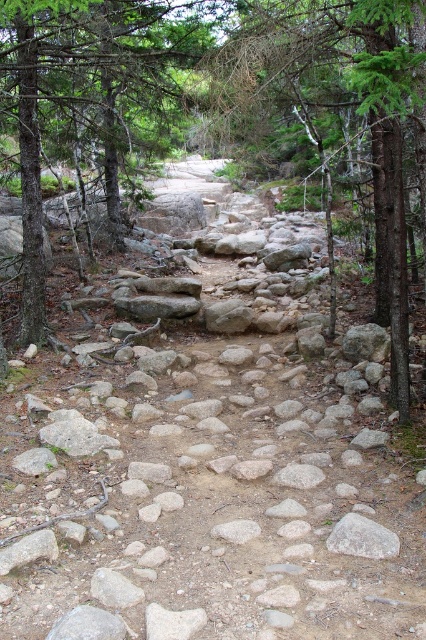
You are a hiker walking along the forest trail and notice a green textured tree at center and a gray rough rock at center. Which object is closer to you as you walk the path?

The green textured tree at center is closer to you because it is positioned further to the viewer than the gray rough rock at center.

You are a hiker carrying a backpack and need to pass through the narrowest part of the trail. You notice the green textured tree at center and the gray rough rock at center. Which object should you avoid to stay on the trail?

The green textured tree at center might be wider than the gray rough rock at center, so you should avoid the green textured tree at center to stay on the trail.